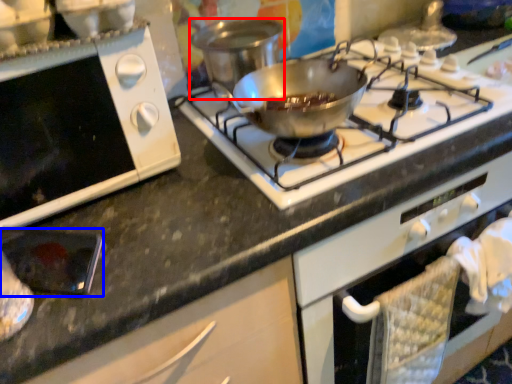
Question: Among these objects, which one is farthest to the camera, pot/pan (highlighted by a red box) or appliance (highlighted by a blue box)?

Choices:
 (A) pot/pan
 (B) appliance

Answer: (A)